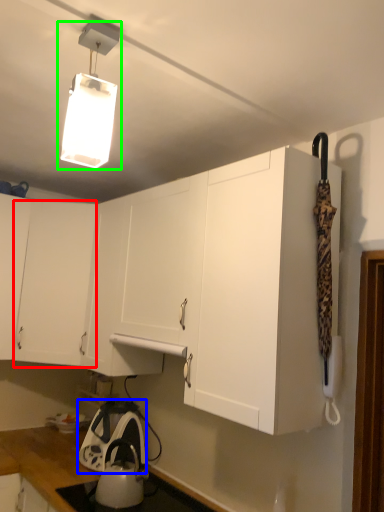
Question: Estimate the real-world distances between objects in this image. Which object is farther from cabinetry (highlighted by a red box), appliance (highlighted by a blue box) or lamp (highlighted by a green box)?

Choices:
 (A) appliance
 (B) lamp

Answer: (B)